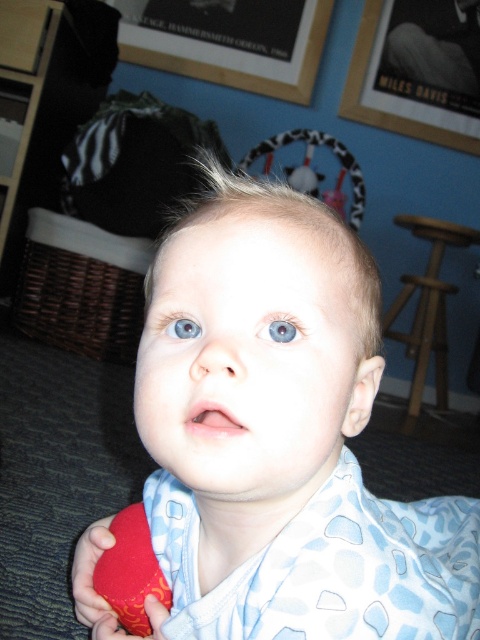
Which is below, blue cotton baby at center or blue matte eye at center?

blue cotton baby at center is lower down.

Is point (360, 260) in front of point (288, 320)?

No.

Locate an element on the screen. Image resolution: width=480 pixels, height=640 pixels. blue cotton baby at center is located at coordinates (280, 436).

Locate an element on the screen. The image size is (480, 640). blue cotton baby at center is located at coordinates (280, 436).

Does wooden framed picture at upper center have a larger size compared to blue glossy eye at center?

Indeed, wooden framed picture at upper center has a larger size compared to blue glossy eye at center.

Does point (369, 77) come closer to viewer compared to point (168, 332)?

No.

This screenshot has height=640, width=480. In order to click on wooden framed picture at upper center in this screenshot , I will do `click(418, 70)`.

Is point (79, 572) positioned before point (462, 17)?

That is True.

Is blue cotton baby at center to the right of wooden framed picture at upper center from the viewer's perspective?

No, blue cotton baby at center is not to the right of wooden framed picture at upper center.

This screenshot has height=640, width=480. In order to click on blue cotton baby at center in this screenshot , I will do `click(280, 436)`.